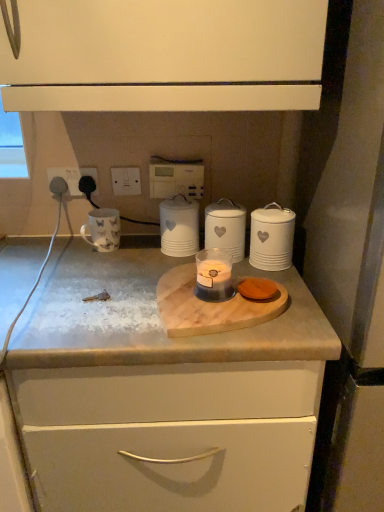
The height and width of the screenshot is (512, 384). I want to click on free space between translucent glass candle at center and white glossy mug at left, so point(131,263).